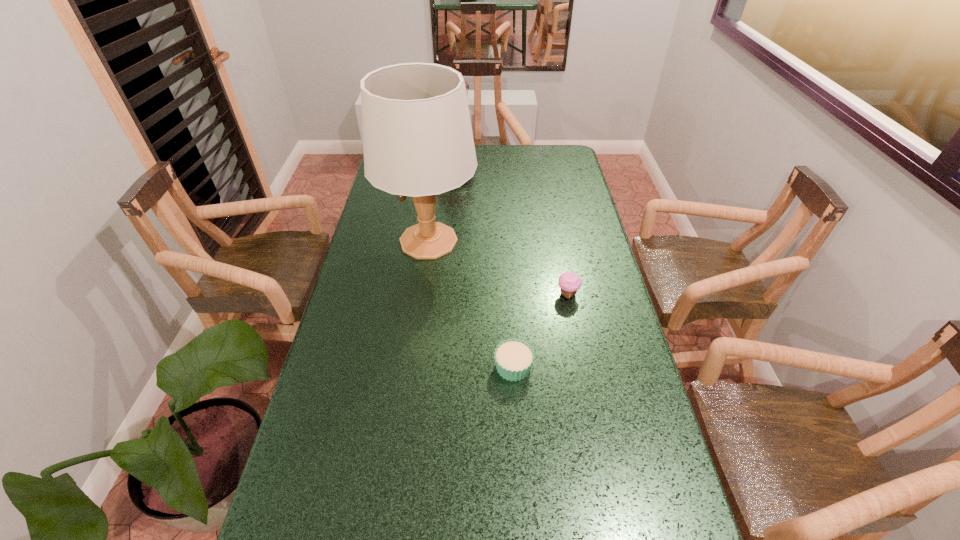
This screenshot has width=960, height=540. Identify the location of object that is the third nearest to the third nearest object. (513, 358).

Where is `vacant space that satisfies the following two spatial constraints: 1. on the controls of the food processor; 2. on the back side of the nearer cupcake`? The height and width of the screenshot is (540, 960). vacant space that satisfies the following two spatial constraints: 1. on the controls of the food processor; 2. on the back side of the nearer cupcake is located at coordinates (439, 367).

This screenshot has width=960, height=540. In order to click on free space that satisfies the following two spatial constraints: 1. on the controls of the second object from right to left; 2. on the left side of the food processor in this screenshot , I will do `click(439, 367)`.

Where is `free region that satisfies the following two spatial constraints: 1. on the controls of the left cupcake; 2. on the left side of the food processor`? This screenshot has width=960, height=540. free region that satisfies the following two spatial constraints: 1. on the controls of the left cupcake; 2. on the left side of the food processor is located at coordinates (439, 367).

Where is `free point that satisfies the following two spatial constraints: 1. on the back side of the third object from left to right; 2. on the controls of the second tallest object`? This screenshot has height=540, width=960. free point that satisfies the following two spatial constraints: 1. on the back side of the third object from left to right; 2. on the controls of the second tallest object is located at coordinates (500, 169).

Where is `blank space that satisfies the following two spatial constraints: 1. on the controls of the shortest object; 2. on the right side of the food processor`? The image size is (960, 540). blank space that satisfies the following two spatial constraints: 1. on the controls of the shortest object; 2. on the right side of the food processor is located at coordinates (439, 367).

The height and width of the screenshot is (540, 960). I want to click on blank space that satisfies the following two spatial constraints: 1. on the controls of the second nearest object; 2. on the right side of the second tallest object, so click(x=444, y=294).

Locate an element on the screen. The height and width of the screenshot is (540, 960). vacant space that satisfies the following two spatial constraints: 1. on the controls of the rightmost object; 2. on the left side of the farthest object is located at coordinates (444, 294).